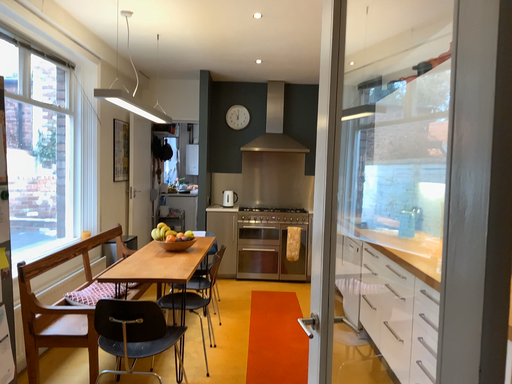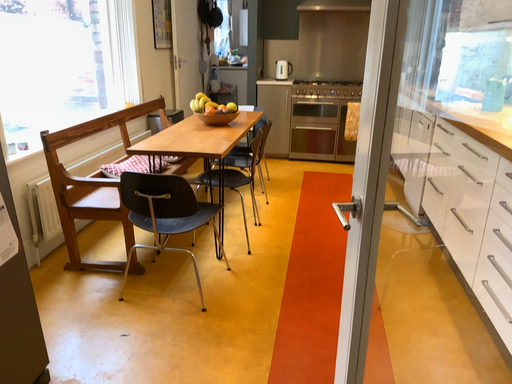
Question: Which way did the camera rotate in the video?

Choices:
 (A) rotated right
 (B) rotated left

Answer: (B)